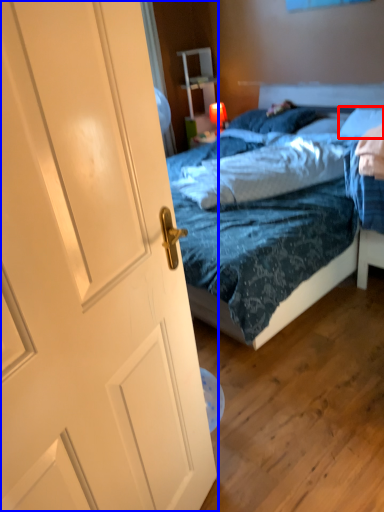
Question: Which object is further to the camera taking this photo, pillow (highlighted by a red box) or door (highlighted by a blue box)?

Choices:
 (A) pillow
 (B) door

Answer: (A)